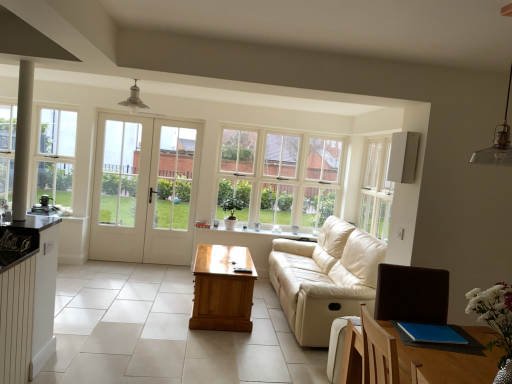
This screenshot has height=384, width=512. I want to click on unoccupied area in front of light brown wooden table at center, so click(x=205, y=348).